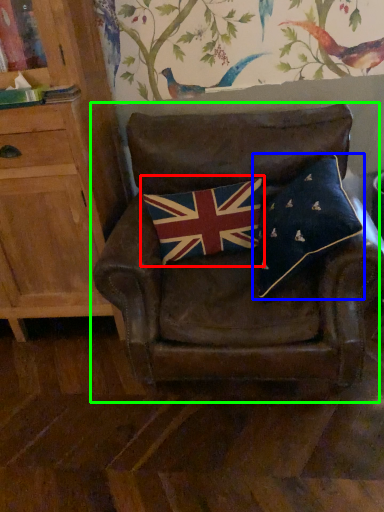
Question: Which object is positioned farthest from flag (highlighted by a red box)? Select from pillow (highlighted by a blue box) and chair (highlighted by a green box).

Choices:
 (A) pillow
 (B) chair

Answer: (A)